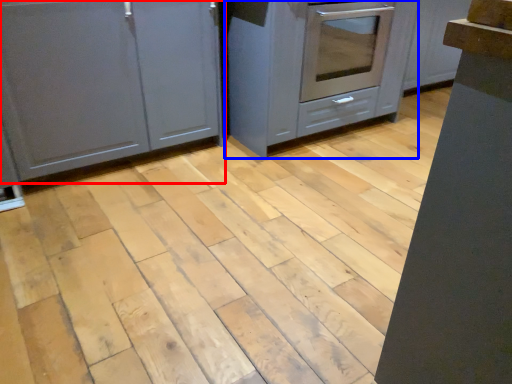
Question: Which of the following is the closest to the observer, cabinetry (highlighted by a red box) or cabinetry (highlighted by a blue box)?

Choices:
 (A) cabinetry
 (B) cabinetry

Answer: (A)